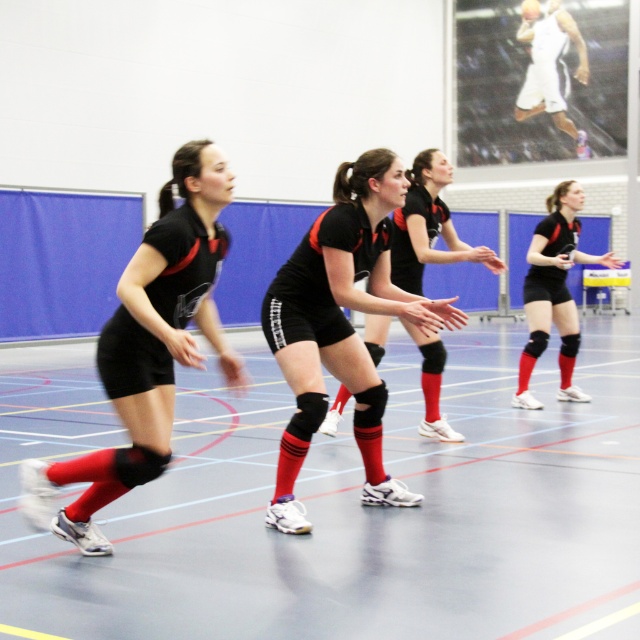
Can you confirm if matte black uniform at center is positioned to the right of matte black knee pads at center?

In fact, matte black uniform at center is to the left of matte black knee pads at center.

Is the position of matte black uniform at center less distant than that of matte black knee pads at center?

Yes, matte black uniform at center is in front of matte black knee pads at center.

Between point (182, 284) and point (522, 352), which one is positioned behind?

The point (522, 352) is more distant.

The image size is (640, 640). I want to click on matte black uniform at center, so pyautogui.click(x=147, y=348).

Is matte black shorts at center below matte black knee pads at center?

Yes.

Is point (436, 406) positioned after point (570, 336)?

No, it is in front of (570, 336).

Locate an element on the screen. The image size is (640, 640). matte black shorts at center is located at coordinates (428, 227).

Is matte black uniform at center above black matte shorts at center?

No.

Between matte black uniform at center and black matte shorts at center, which one is positioned lower?

Positioned lower is matte black uniform at center.

Find the location of a particular element. The image size is (640, 640). matte black uniform at center is located at coordinates (147, 348).